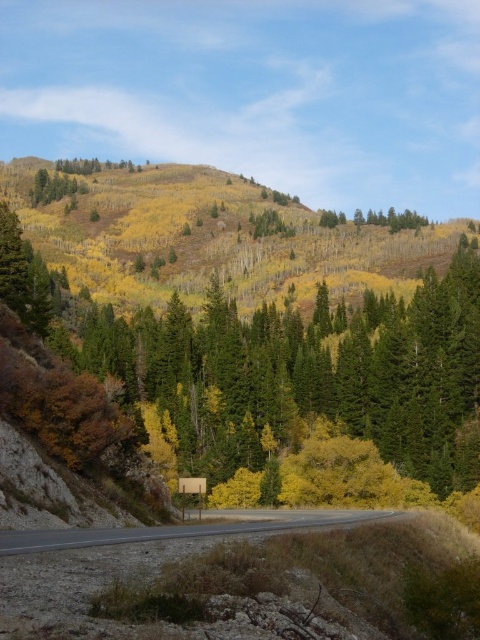
Between point (28, 536) and point (192, 492), which one is positioned in front?

Point (28, 536)

Who is more forward, (159, 531) or (184, 496)?

Point (159, 531) is in front.

Locate an element on the screen. gray asphalt road at center is located at coordinates (170, 531).